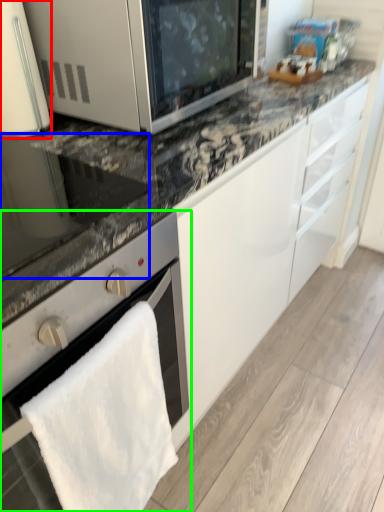
Question: Estimate the real-world distances between objects in this image. Which object is farther from home appliance (highlighted by a red box), appliance (highlighted by a blue box) or oven (highlighted by a green box)?

Choices:
 (A) appliance
 (B) oven

Answer: (B)